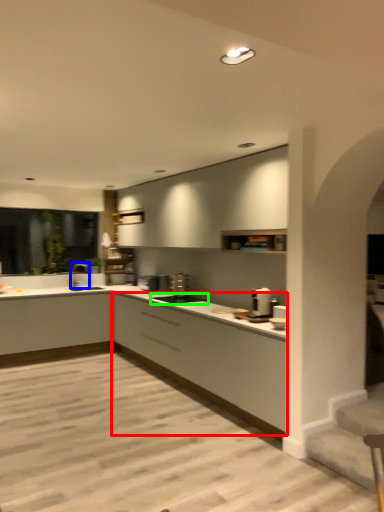
Question: Which object is positioned farthest from cabinetry (highlighted by a red box)? Select from tap (highlighted by a blue box) and appliance (highlighted by a green box).

Choices:
 (A) tap
 (B) appliance

Answer: (A)